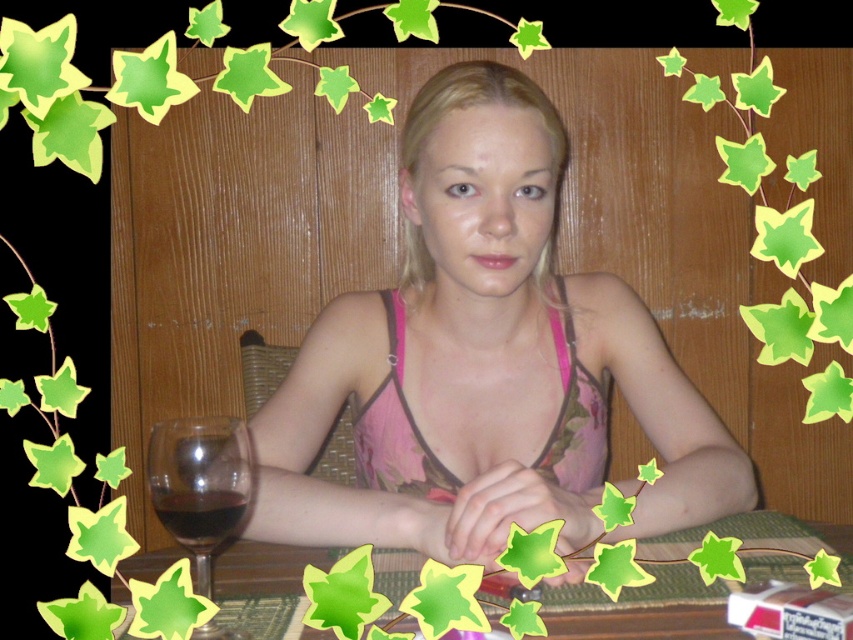
Consider the image. You are a photographer setting up for a photoshoot. The pink floral bikini top at center and the transparent glass at lower left are both in the frame. Based on their sizes, which object would you adjust your camera focus to capture more clearly?

The pink floral bikini top at center is wider than the transparent glass at lower left, so adjusting focus on the pink floral bikini top at center would ensure it appears clearer due to its larger size in the frame.

You are a photographer setting up a shoot in this dining area. You need to ensure that the pink floral bikini top at center and the transparent glass at lower left are visible in the frame. Based on their positions, which object would you adjust to be closer to the camera to ensure both are in focus?

The transparent glass at lower left is lower than the pink floral bikini top at center. To ensure both are in focus, you should raise the transparent glass at lower left to align it closer to the height of the pink floral bikini top at center.

You are standing in the dining area and want to place a small decorative item on the table. The bamboo mat at center is located at point (641,609). Where should you place the item to ensure it is directly above the bamboo mat at center?

Place the item at point (641,609) to position it directly above the bamboo mat at center.